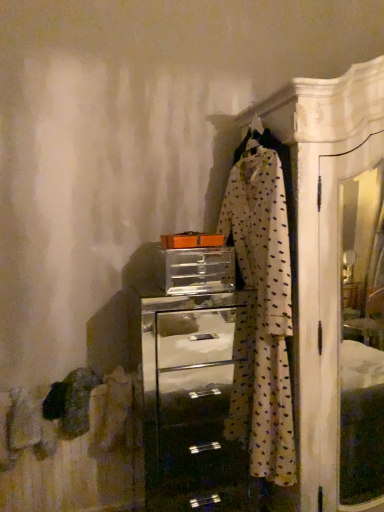
Locate an element on the screen. This screenshot has height=512, width=384. clear plastic drawer at center is located at coordinates click(195, 270).

This screenshot has height=512, width=384. Identify the location of white dotted fabric at center. (262, 312).

Considering the points (167, 294) and (204, 471), which point is behind, point (167, 294) or point (204, 471)?

Positioned behind is point (204, 471).

Is clear plastic drawer at center located outside metallic silver chest of drawers at center?

Yes.

Does clear plastic drawer at center come in front of metallic silver chest of drawers at center?

No, clear plastic drawer at center is further to the viewer.

Considering the positions of objects clear plastic drawer at center and white dotted fabric at center in the image provided, who is in front, clear plastic drawer at center or white dotted fabric at center?

white dotted fabric at center.

Considering the relative positions of clear plastic drawer at center and white dotted fabric at center in the image provided, is clear plastic drawer at center to the right of white dotted fabric at center from the viewer's perspective?

Incorrect, clear plastic drawer at center is not on the right side of white dotted fabric at center.

Is white dotted fabric at center a part of clear plastic drawer at center?

No, white dotted fabric at center is located outside of clear plastic drawer at center.

Looking at this image, considering the relative sizes of clear plastic drawer at center and white dotted fabric at center in the image provided, is clear plastic drawer at center bigger than white dotted fabric at center?

Actually, clear plastic drawer at center might be smaller than white dotted fabric at center.

Is white dotted fabric at center touching clear plastic drawer at center?

No, white dotted fabric at center is not touching clear plastic drawer at center.

Can you confirm if white dotted fabric at center is positioned to the right of clear plastic drawer at center?

Answer: Yes.

Measure the distance from white dotted fabric at center to clear plastic drawer at center.

The distance of white dotted fabric at center from clear plastic drawer at center is 10.18 inches.

Looking at their sizes, would you say white dotted fabric at center is wider or thinner than clear plastic drawer at center?

In the image, white dotted fabric at center appears to be more narrow than clear plastic drawer at center.

From the picture: Which of these two, metallic silver chest of drawers at center or clear plastic drawer at center, stands shorter?

clear plastic drawer at center is shorter.

Is metallic silver chest of drawers at center wider or thinner than clear plastic drawer at center?

In the image, metallic silver chest of drawers at center appears to be wider than clear plastic drawer at center.

Identify the location of drawer on the left of metallic silver chest of drawers at center. (195, 270).

From the picture: Is metallic silver chest of drawers at center not close to clear plastic drawer at center?

metallic silver chest of drawers at center is positioned a significant distance from clear plastic drawer at center.

Is the surface of metallic silver chest of drawers at center in direct contact with white dotted fabric at center?

metallic silver chest of drawers at center and white dotted fabric at center are clearly separated.

Is metallic silver chest of drawers at center to the right of white dotted fabric at center from the viewer's perspective?

No.

Is metallic silver chest of drawers at center oriented towards white dotted fabric at center?

No, metallic silver chest of drawers at center is not facing towards white dotted fabric at center.

Is white dotted fabric at center outside of metallic silver chest of drawers at center?

Yes.

How distant is white dotted fabric at center from metallic silver chest of drawers at center?

31.54 inches.

Does white dotted fabric at center have a greater height compared to metallic silver chest of drawers at center?

Correct, white dotted fabric at center is much taller as metallic silver chest of drawers at center.

Between point (262, 276) and point (238, 463), which one is positioned behind?

The point (238, 463) is farther.

Where is `drawer above the metallic silver chest of drawers at center (from the image's perspective)`? This screenshot has height=512, width=384. drawer above the metallic silver chest of drawers at center (from the image's perspective) is located at coordinates (195, 270).

At what (x,y) coordinates should I click in order to perform the action: click on clothing below the clear plastic drawer at center (from the image's perspective). Please return your answer as a coordinate pair (x, y). Looking at the image, I should click on (262, 312).

From the image, which object appears to be farther from white dotted fabric at center, metallic silver chest of drawers at center or clear plastic drawer at center?

metallic silver chest of drawers at center lies further to white dotted fabric at center than the other object.

Looking at the image, which one is located closer to metallic silver chest of drawers at center, white dotted fabric at center or clear plastic drawer at center?

Among the two, white dotted fabric at center is located nearer to metallic silver chest of drawers at center.

Estimate the real-world distances between objects in this image. Which object is closer to white dotted fabric at center, clear plastic drawer at center or metallic silver chest of drawers at center?

Based on the image, clear plastic drawer at center appears to be nearer to white dotted fabric at center.

Considering their positions, is clear plastic drawer at center positioned further to metallic silver chest of drawers at center than white dotted fabric at center?

clear plastic drawer at center.

Considering their positions, is white dotted fabric at center positioned closer to clear plastic drawer at center than metallic silver chest of drawers at center?

white dotted fabric at center.

From the image, which object appears to be farther from clear plastic drawer at center, metallic silver chest of drawers at center or white dotted fabric at center?

metallic silver chest of drawers at center.

Identify the location of clothing between clear plastic drawer at center and metallic silver chest of drawers at center in the up-down direction. The width and height of the screenshot is (384, 512). (262, 312).